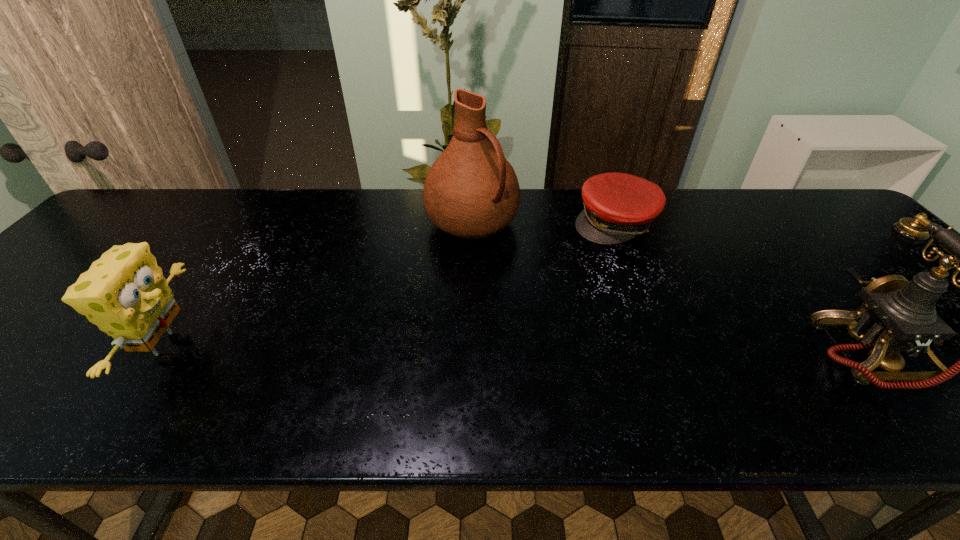
At what (x,y) coordinates should I click in order to perform the action: click on free spot at the far left corner of the desktop. Please return your answer as a coordinate pair (x, y). This screenshot has height=540, width=960. Looking at the image, I should click on (132, 230).

The image size is (960, 540). In order to click on vacant space at the far right corner of the desktop in this screenshot , I will do `click(807, 193)`.

Where is `free space between the leftmost object and the pitcher`? This screenshot has width=960, height=540. free space between the leftmost object and the pitcher is located at coordinates (322, 286).

You are a GUI agent. You are given a task and a screenshot of the screen. Output one action in this format:
    pyautogui.click(x=<x>, y=<y>)
    Task: Click on the free space between the pitcher and the leftmost object
    The height and width of the screenshot is (540, 960).
    Given the screenshot: What is the action you would take?
    pyautogui.click(x=322, y=286)

Where is `empty space between the third object from left to right and the leftmost object`? empty space between the third object from left to right and the leftmost object is located at coordinates (393, 286).

Find the location of a particular element. This screenshot has height=540, width=960. vacant space that's between the sponge and the second object from left to right is located at coordinates (322, 286).

The height and width of the screenshot is (540, 960). I want to click on unoccupied position between the tallest object and the third object from left to right, so click(543, 222).

Locate an element on the screen. This screenshot has height=540, width=960. free space between the cap and the pitcher is located at coordinates (543, 222).

Find the location of a particular element. The image size is (960, 540). object identified as the closest to the second shortest object is located at coordinates (471, 191).

Identify which object is the third nearest to the second shortest object. Please provide its 2D coordinates. Your answer should be formatted as a tuple, i.e. [(x, y)], where the tuple contains the x and y coordinates of a point satisfying the conditions above.

[(897, 315)]